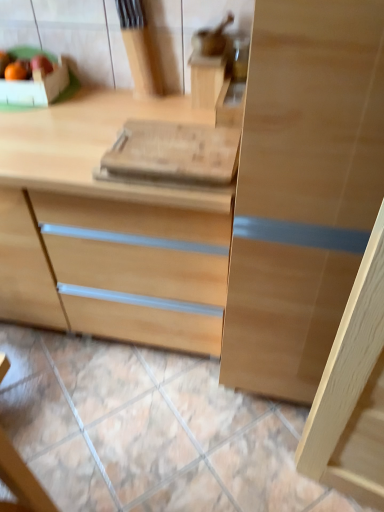
Question: Does matte wooden apple at upper left have a lesser height compared to natural wood chest of drawers at center?

Choices:
 (A) yes
 (B) no

Answer: (A)

Question: Is matte wooden apple at upper left not close to natural wood chest of drawers at center?

Choices:
 (A) no
 (B) yes

Answer: (A)

Question: From the image's perspective, would you say matte wooden apple at upper left is positioned over natural wood chest of drawers at center?

Choices:
 (A) yes
 (B) no

Answer: (A)

Question: Considering the relative sizes of matte wooden apple at upper left and natural wood chest of drawers at center in the image provided, is matte wooden apple at upper left wider than natural wood chest of drawers at center?

Choices:
 (A) yes
 (B) no

Answer: (B)

Question: Does matte wooden apple at upper left have a greater height compared to natural wood chest of drawers at center?

Choices:
 (A) yes
 (B) no

Answer: (B)

Question: Does matte wooden apple at upper left have a larger size compared to natural wood chest of drawers at center?

Choices:
 (A) no
 (B) yes

Answer: (A)

Question: Does natural wood chest of drawers at center have a larger size compared to matte wooden apple at upper left?

Choices:
 (A) yes
 (B) no

Answer: (A)

Question: Is natural wood chest of drawers at center positioned before matte wooden apple at upper left?

Choices:
 (A) no
 (B) yes

Answer: (B)

Question: Considering the relative sizes of natural wood chest of drawers at center and matte wooden apple at upper left in the image provided, is natural wood chest of drawers at center thinner than matte wooden apple at upper left?

Choices:
 (A) no
 (B) yes

Answer: (A)

Question: Is natural wood chest of drawers at center positioned beyond the bounds of matte wooden apple at upper left?

Choices:
 (A) yes
 (B) no

Answer: (A)

Question: From the image's perspective, is natural wood chest of drawers at center beneath matte wooden apple at upper left?

Choices:
 (A) no
 (B) yes

Answer: (B)

Question: Considering the relative positions of natural wood chest of drawers at center and matte wooden apple at upper left in the image provided, is natural wood chest of drawers at center to the left of matte wooden apple at upper left from the viewer's perspective?

Choices:
 (A) no
 (B) yes

Answer: (A)

Question: From the image's perspective, is natural stone tile at lower center located above matte wooden apple at upper left?

Choices:
 (A) no
 (B) yes

Answer: (A)